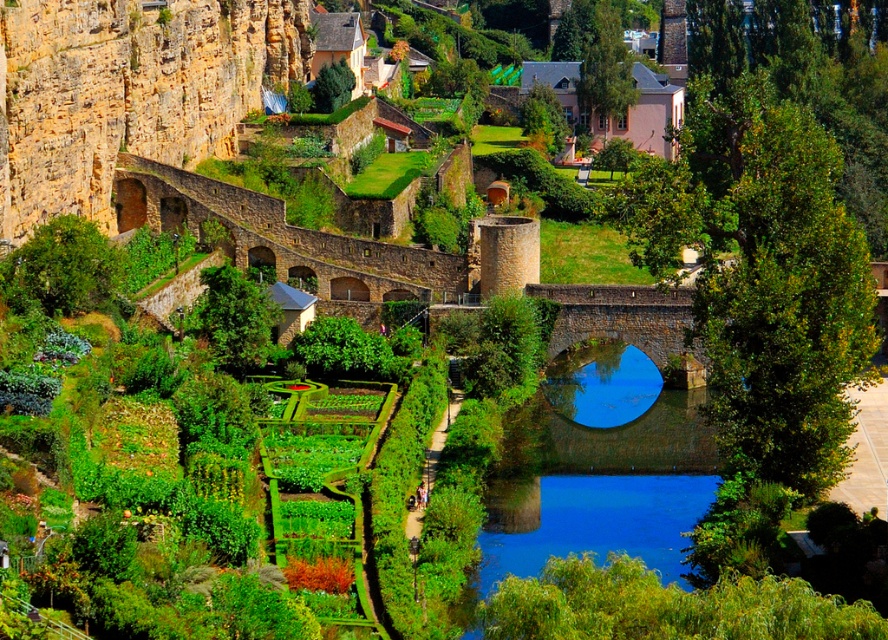
Question: Does yellow stone cliff at upper left appear on the right side of blue stone bridge at center?

Choices:
 (A) no
 (B) yes

Answer: (A)

Question: Which point is closer to the camera?

Choices:
 (A) (105, 216)
 (B) (664, 470)

Answer: (B)

Question: Does yellow stone cliff at upper left have a larger size compared to blue stone bridge at center?

Choices:
 (A) no
 (B) yes

Answer: (B)

Question: Is yellow stone cliff at upper left behind blue stone bridge at center?

Choices:
 (A) yes
 (B) no

Answer: (A)

Question: Which object appears farthest from the camera in this image?

Choices:
 (A) yellow stone cliff at upper left
 (B) blue stone bridge at center

Answer: (A)